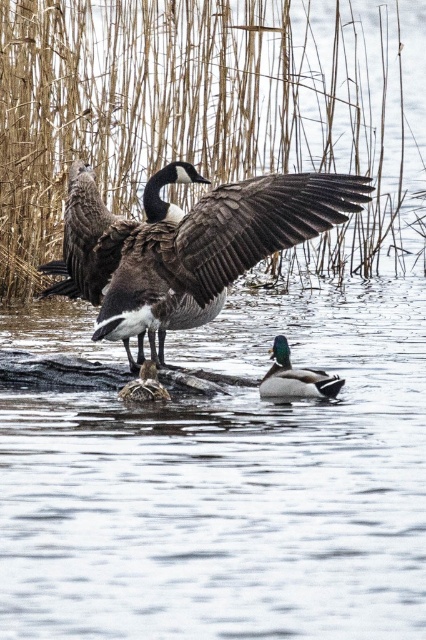
You are a birdwatcher observing the scene. You notice the brown feathered goose at center and its dark brown feathered wing at center. Which object is bigger in size?

The brown feathered goose at center is larger in size compared to the dark brown feathered wing at center.

You are a birdwatcher trying to identify the goose at the center of the image. The coordinates given are part of the goose. What part of the goose is located at point (187, 243)?

The point (187, 243) is on the brown feathered goose at center.